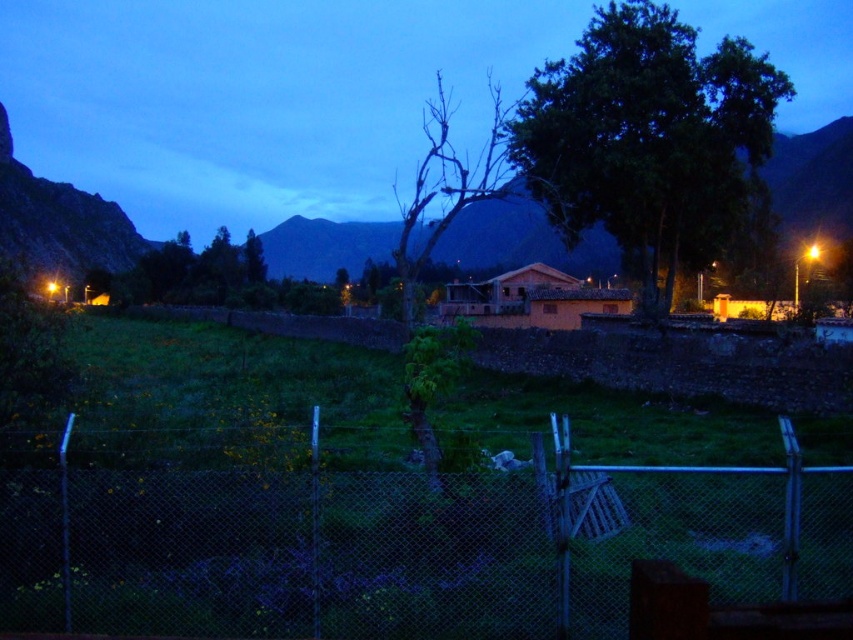
In the scene shown: Is metal chain-link fence at lower center behind green leafy tree at upper center?

No, metal chain-link fence at lower center is closer to the viewer.

Which is more to the right, metal chain-link fence at lower center or green leafy tree at upper center?

metal chain-link fence at lower center

Consider the image. Who is more forward, (114, 548) or (258, 273)?

Positioned in front is point (114, 548).

Locate an element on the screen. Image resolution: width=853 pixels, height=640 pixels. metal chain-link fence at lower center is located at coordinates (409, 545).

Between green leafy tree at center and green leafy tree at upper center, which one is positioned higher?

green leafy tree at center is above.

Is point (610, 182) behind point (248, 252)?

That is False.

Who is more forward, (645,284) or (244,266)?

Positioned in front is point (645,284).

This screenshot has height=640, width=853. I want to click on green leafy tree at center, so click(648, 140).

Which is more to the right, metal chain-link fence at lower center or green leafy tree at center?

green leafy tree at center

Looking at this image, can you confirm if metal chain-link fence at lower center is smaller than green leafy tree at center?

Yes.

Does point (773, 579) come behind point (671, 74)?

No.

This screenshot has height=640, width=853. What are the coordinates of `metal chain-link fence at lower center` in the screenshot? It's located at (409, 545).